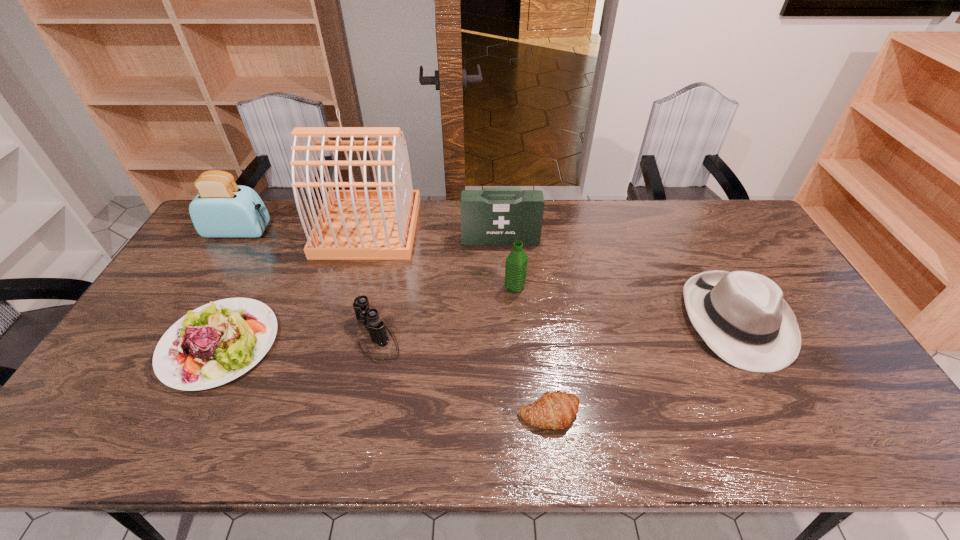
Where is `vacant space that satisfies the following two spatial constraints: 1. on the back side of the water bottle; 2. with an open door on the tallest object`? Image resolution: width=960 pixels, height=540 pixels. vacant space that satisfies the following two spatial constraints: 1. on the back side of the water bottle; 2. with an open door on the tallest object is located at coordinates (510, 227).

Image resolution: width=960 pixels, height=540 pixels. In order to click on vacant space that satisfies the following two spatial constraints: 1. on the side of the toaster with the lever; 2. on the left side of the crescent roll in this screenshot , I will do coord(128,414).

What are the coordinates of `free space that satisfies the following two spatial constraints: 1. with an open door on the binoculars; 2. on the left side of the tallest object` in the screenshot? It's located at (337, 335).

Where is `vacant area in the image that satisfies the following two spatial constraints: 1. on the back side of the crescent roll; 2. on the side of the toaster with the lever`? This screenshot has height=540, width=960. vacant area in the image that satisfies the following two spatial constraints: 1. on the back side of the crescent roll; 2. on the side of the toaster with the lever is located at coordinates (527, 231).